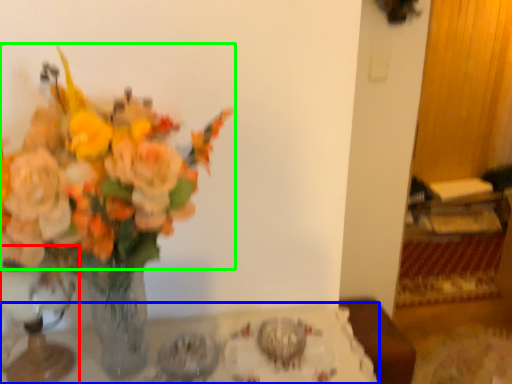
Question: Based on their relative distances, which object is nearer to vase (highlighted by a red box)? Choose from table (highlighted by a blue box) and flower (highlighted by a green box).

Choices:
 (A) table
 (B) flower

Answer: (A)